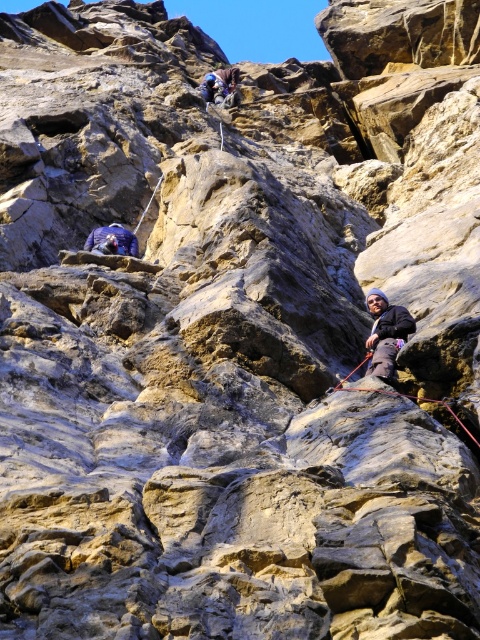
Which is behind, point (372, 308) or point (211, 99)?

Positioned behind is point (211, 99).

Is point (400, 321) behind point (208, 92)?

No, (400, 321) is closer to viewer.

At what (x,y) coordinates should I click in order to perform the action: click on dark blue fabric at right. Please return your answer as a coordinate pair (x, y). This screenshot has width=480, height=640. Looking at the image, I should click on (385, 332).